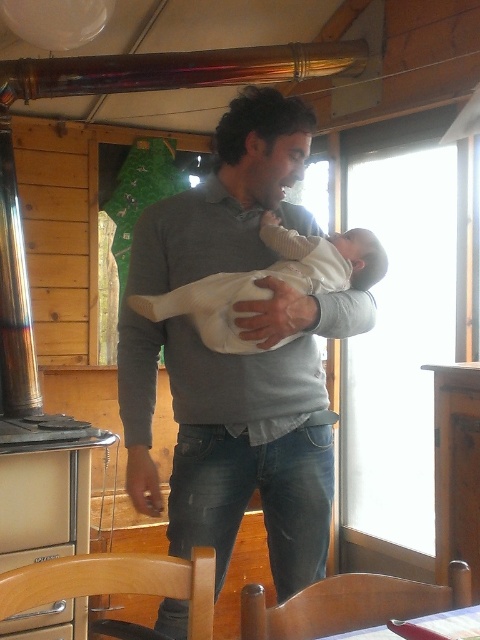
What is located at the point with coordinates [238,356] in the image?

The gray cotton sweater at center is located at point [238,356].

Where is the gray cotton sweater at center located in the image?

The gray cotton sweater at center is located at point [238,356] in the image.

You are designing a photo frame for this scene. The frame has a fixed width that can only accommodate objects up to the width of the gray cotton sweater at center. Will the white soft baby at center fit within this frame?

The gray cotton sweater at center is wider than the white soft baby at center. Since the frame can accommodate up to the sweater width, the baby will fit within the frame.